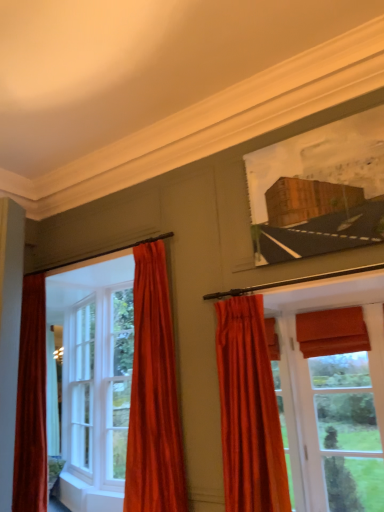
Question: Does velvet orange curtain at left, the 2th curtain when ordered from right to left, have a larger size compared to wooden frame at upper right?

Choices:
 (A) yes
 (B) no

Answer: (A)

Question: From a real-world perspective, is velvet orange curtain at left, the 2th curtain when ordered from right to left, under wooden frame at upper right?

Choices:
 (A) yes
 (B) no

Answer: (A)

Question: Does velvet orange curtain at left, the 2th curtain when ordered from right to left, have a greater height compared to wooden frame at upper right?

Choices:
 (A) yes
 (B) no

Answer: (A)

Question: Can you confirm if velvet orange curtain at left, the 2th curtain when ordered from right to left, is thinner than wooden frame at upper right?

Choices:
 (A) no
 (B) yes

Answer: (A)

Question: Is velvet orange curtain at left, the 2th curtain when ordered from right to left, positioned behind wooden frame at upper right?

Choices:
 (A) no
 (B) yes

Answer: (B)

Question: Visually, is wooden frame at upper right positioned to the left or to the right of velvet orange curtain at center, acting as the second curtain starting from the left?

Choices:
 (A) right
 (B) left

Answer: (A)

Question: In terms of height, does wooden frame at upper right look taller or shorter compared to velvet orange curtain at center, the first curtain positioned from the right?

Choices:
 (A) short
 (B) tall

Answer: (A)

Question: Does point (253, 183) appear closer or farther from the camera than point (223, 451)?

Choices:
 (A) farther
 (B) closer

Answer: (A)

Question: Looking at the image, does wooden frame at upper right seem bigger or smaller compared to velvet orange curtain at center, acting as the second curtain starting from the left?

Choices:
 (A) big
 (B) small

Answer: (B)

Question: In the image, is white wood window at left, the first window when ordered from left to right, on the left side or the right side of wooden frame at upper right?

Choices:
 (A) left
 (B) right

Answer: (A)

Question: Is white wood window at left, the second window viewed from the front, inside the boundaries of wooden frame at upper right, or outside?

Choices:
 (A) inside
 (B) outside

Answer: (B)

Question: Considering the positions of point (102, 288) and point (367, 131), is point (102, 288) closer or farther from the camera than point (367, 131)?

Choices:
 (A) closer
 (B) farther

Answer: (B)

Question: In terms of width, does white wood window at left, the first window when ordered from left to right, look wider or thinner when compared to wooden frame at upper right?

Choices:
 (A) thin
 (B) wide

Answer: (B)

Question: Is velvet orange curtain at center, acting as the second curtain starting from the left, bigger or smaller than white wood window at left, the second window viewed from the front?

Choices:
 (A) small
 (B) big

Answer: (A)

Question: From the image's perspective, is velvet orange curtain at center, acting as the second curtain starting from the left, above or below white wood window at left, which appears as the second window when viewed from the right?

Choices:
 (A) below
 (B) above

Answer: (B)